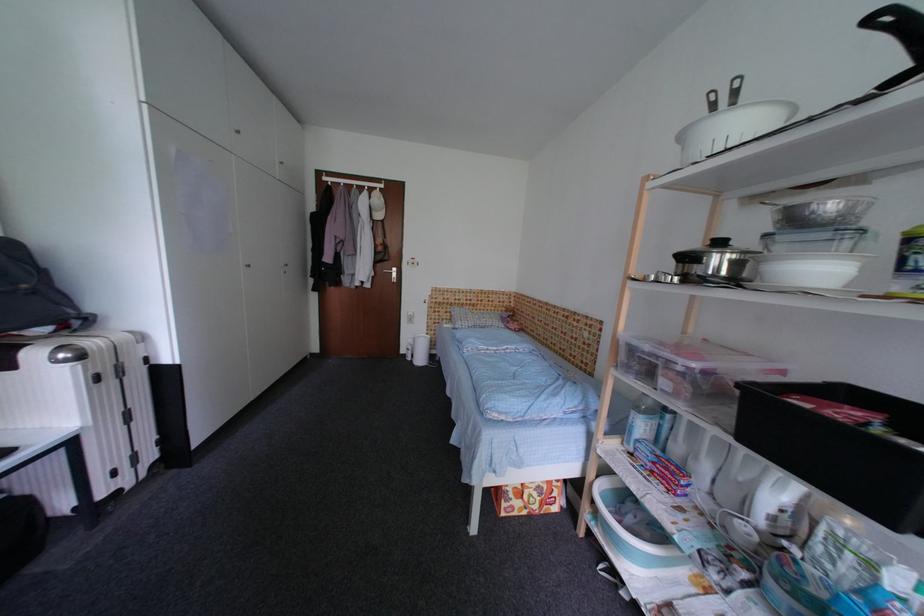
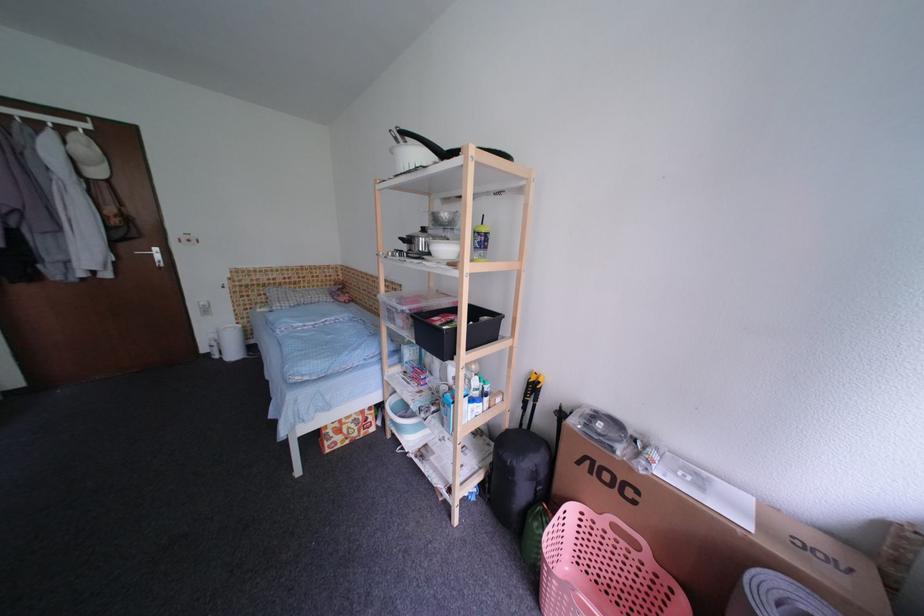
In the second image, find the point that corresponds to (x=593, y=517) in the first image.

(395, 426)